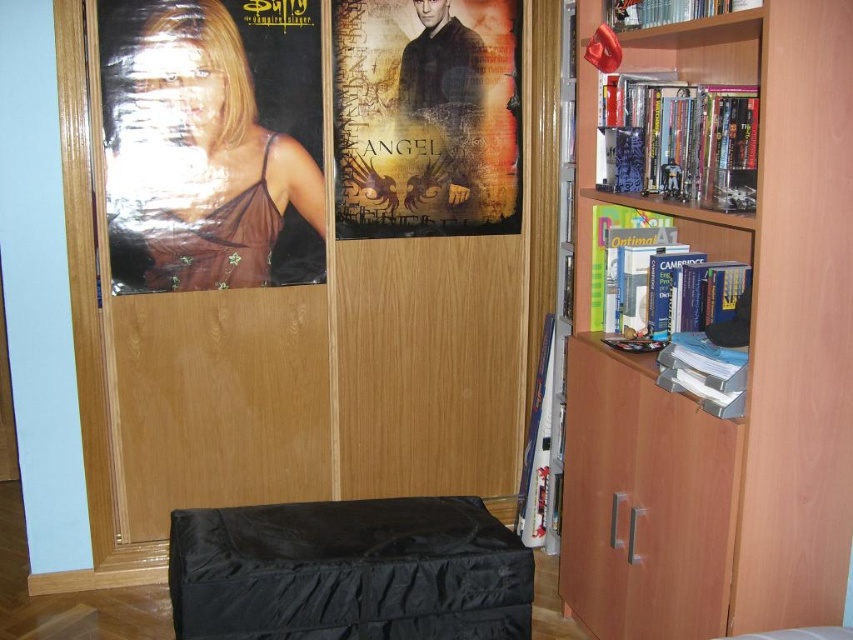
You are sitting on the black fabric stool at lower center and want to reach the textured paper poster at center to dust it. Is the poster within your reach?

The black fabric stool at lower center is below the textured paper poster at center, so if you are sitting on the stool, the poster is above you and may be out of reach unless you stand up.

You are standing in the room and want to place a new book on the light brown wood bookshelf at right. Based on the image, can you determine the exact coordinates where the book should be placed?

The light brown wood bookshelf at right is located at coordinates point (749, 360), so the book should be placed there.

You are arranging a new poster that is 1 meter tall. You want to place it in the same area as the matte black poster at left and wooden bookshelf at upper right. Based on their heights, which object should you place the new poster next to to ensure it doesn

The matte black poster at left has a greater height compared to the wooden bookshelf at upper right. Since the new poster is 1 meter tall, it should be placed next to the matte black poster at left because it is taller and can accommodate the height of the new poster.